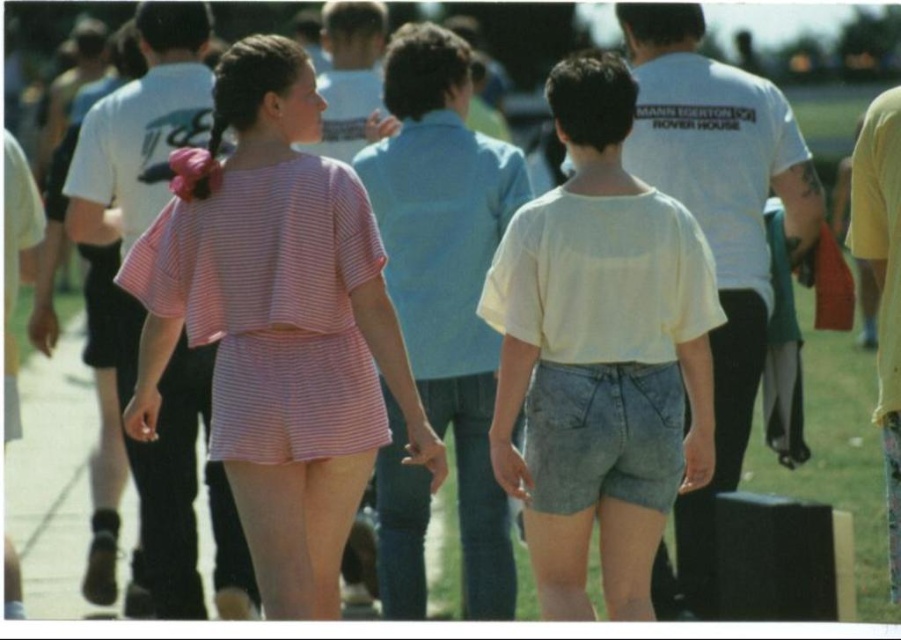
In the scene shown: You are a photographer trying to capture both the light yellow cotton shirt at center and the pink striped shirt at center in the same frame. Which shirt should you adjust to ensure both are visible? Explain your reasoning based on their positions.

The light yellow cotton shirt at center is positioned on the right side of the pink striped shirt at center. To ensure both are visible in the frame, you should adjust the light yellow cotton shirt at center to move it slightly to the left or the pink striped shirt at center to move to the right, as they are currently overlapping or too close in the center.

You are a photographer trying to capture both the light yellow cotton shirt at center and the pink striped shirt at center in a single frame. Which shirt should you focus on first to ensure both are in the frame?

The light yellow cotton shirt at center is bigger than the pink striped shirt at center, so you should focus on the light yellow cotton shirt at center first to ensure both are in the frame.

You are a photographer trying to capture the pink striped fabric shorts at center in your shot. Based on their 2D coordinates, where should you position your camera to ensure they are centered in the frame?

The pink striped fabric shorts at center are located at coordinates point (279,326), so positioning the camera to center on those coordinates will ensure they are centered in the frame.